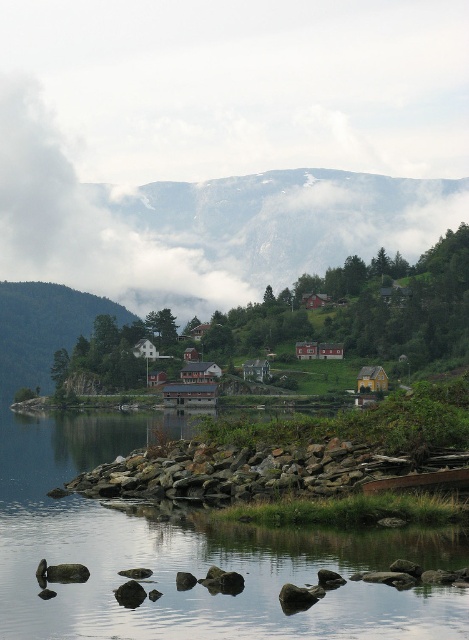
Question: Among these objects, which one is nearest to the camera?

Choices:
 (A) rocky gray mountain at upper center
 (B) green grassy hillside at left
 (C) smooth rock water at lower center
 (D) rocky shore at lower center

Answer: (C)

Question: Which point is farther to the camera?

Choices:
 (A) (194, 442)
 (B) (433, 212)
 (C) (180, 545)
 (D) (37, 355)

Answer: (B)

Question: Does rocky gray mountain at upper center appear on the right side of rocky shore at lower center?

Choices:
 (A) no
 (B) yes

Answer: (B)

Question: Where is smooth rock water at lower center located in relation to rocky shore at lower center in the image?

Choices:
 (A) left
 (B) right

Answer: (A)

Question: Does smooth rock water at lower center appear on the left side of rocky shore at lower center?

Choices:
 (A) no
 (B) yes

Answer: (B)

Question: Which point is farther to the camera?

Choices:
 (A) (432, 449)
 (B) (250, 221)
 (C) (8, 355)

Answer: (B)